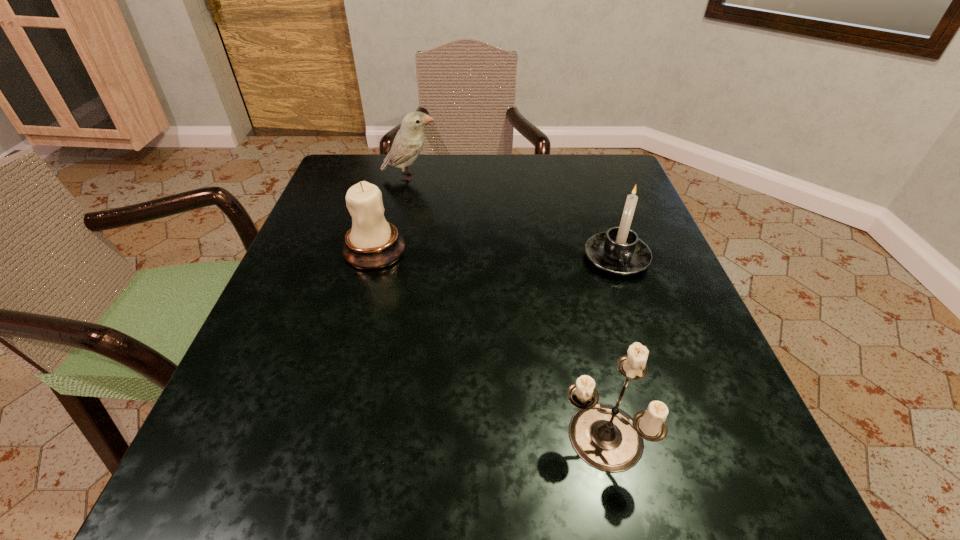
Locate an element on the screen. Image resolution: width=960 pixels, height=540 pixels. bird is located at coordinates (409, 140).

The width and height of the screenshot is (960, 540). In order to click on the leftmost candle holder in this screenshot , I will do `click(372, 243)`.

Where is `the nearest candle holder`? The image size is (960, 540). the nearest candle holder is located at coordinates (605, 437).

At what (x,y) coordinates should I click in order to perform the action: click on vacant region located 0.210m at the face of the farthest object. Please return your answer as a coordinate pair (x, y). Image resolution: width=960 pixels, height=540 pixels. Looking at the image, I should click on (524, 177).

Find the location of a particular element. The image size is (960, 540). vacant region located 0.060m on the back of the leftmost candle holder is located at coordinates (384, 215).

What are the coordinates of `free space located on the back of the nearest candle holder` in the screenshot? It's located at (585, 363).

You are a GUI agent. You are given a task and a screenshot of the screen. Output one action in this format:
    pyautogui.click(x=<x>, y=<y>)
    Task: Click on the object that is at the far edge
    
    Given the screenshot: What is the action you would take?
    pyautogui.click(x=409, y=140)

This screenshot has width=960, height=540. In order to click on object at the near edge in this screenshot , I will do `click(605, 437)`.

Identify the location of bird that is at the left edge. This screenshot has height=540, width=960. (409, 140).

Find the location of a particular element. candle holder that is at the left edge is located at coordinates (372, 243).